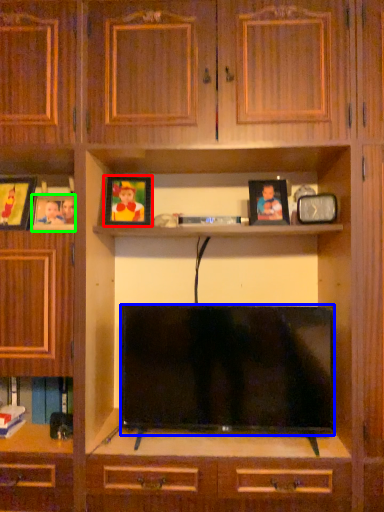
Question: Based on their relative distances, which object is farther from picture frame (highlighted by a red box)? Choose from television (highlighted by a blue box) and picture frame (highlighted by a green box).

Choices:
 (A) television
 (B) picture frame

Answer: (A)